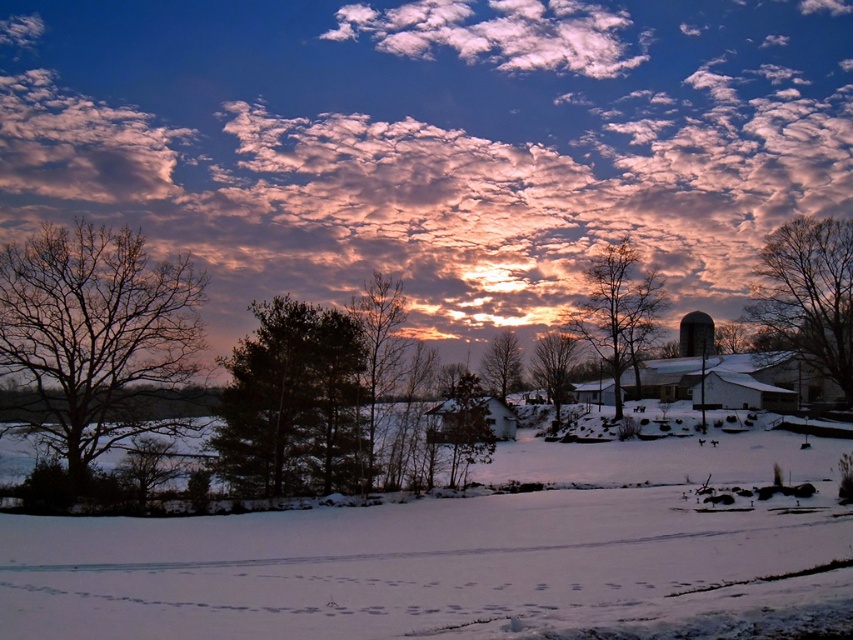
Can you confirm if white powdery snow at center is thinner than dark green textured tree at center?

Incorrect, white powdery snow at center's width is not less than dark green textured tree at center's.

Can you confirm if white powdery snow at center is positioned to the left of dark green textured tree at center?

Incorrect, white powdery snow at center is not on the left side of dark green textured tree at center.

This screenshot has height=640, width=853. What do you see at coordinates (412, 564) in the screenshot?
I see `white powdery snow at center` at bounding box center [412, 564].

At what (x,y) coordinates should I click in order to perform the action: click on white powdery snow at center. Please return your answer as a coordinate pair (x, y). Image resolution: width=853 pixels, height=640 pixels. Looking at the image, I should click on (412, 564).

Identify the location of white fluffy cloud at upper center. The image size is (853, 640). (498, 33).

Is white fluffy cloud at upper center above white wood barn at center?

Indeed, white fluffy cloud at upper center is positioned over white wood barn at center.

Image resolution: width=853 pixels, height=640 pixels. I want to click on white fluffy cloud at upper center, so click(498, 33).

Find the location of a particular element. white fluffy cloud at upper center is located at coordinates (498, 33).

Who is higher up, white fluffy cloud at upper center or brown textured tree at center?

Positioned higher is white fluffy cloud at upper center.

Which is in front, point (535, 32) or point (486, 372)?

Point (486, 372) is in front.

Find the location of a particular element. Image resolution: width=853 pixels, height=640 pixels. white fluffy cloud at upper center is located at coordinates (498, 33).

You are a GUI agent. You are given a task and a screenshot of the screen. Output one action in this format:
    pyautogui.click(x=<x>, y=<y>)
    Task: Click on the white fluffy cloud at upper center
    
    Given the screenshot: What is the action you would take?
    pyautogui.click(x=498, y=33)